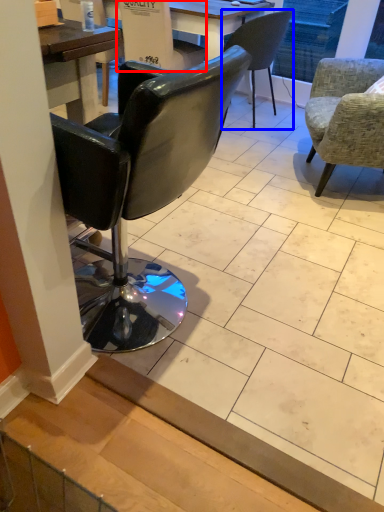
Question: Among these objects, which one is nearest to the camera, armchair (highlighted by a red box) or chair (highlighted by a blue box)?

Choices:
 (A) armchair
 (B) chair

Answer: (A)